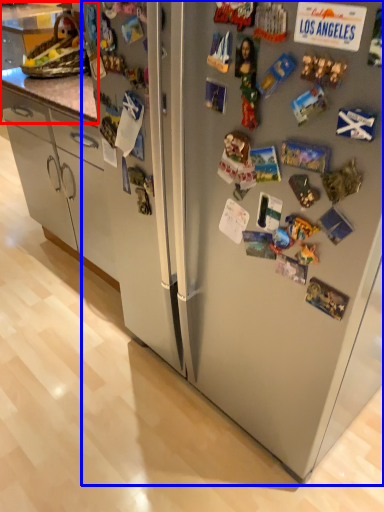
Question: Which of the following is the closest to the observer, counter top (highlighted by a red box) or refrigerator (highlighted by a blue box)?

Choices:
 (A) counter top
 (B) refrigerator

Answer: (B)